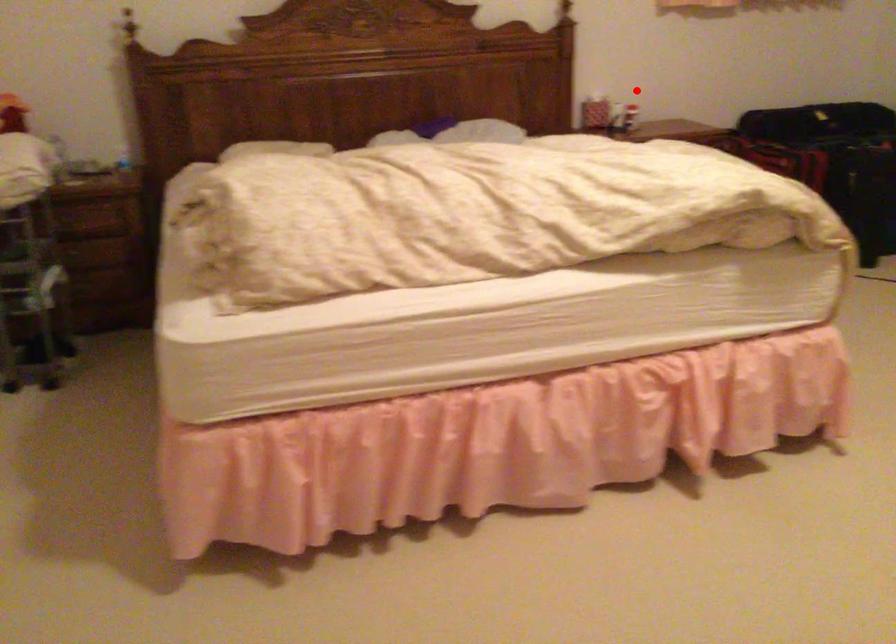
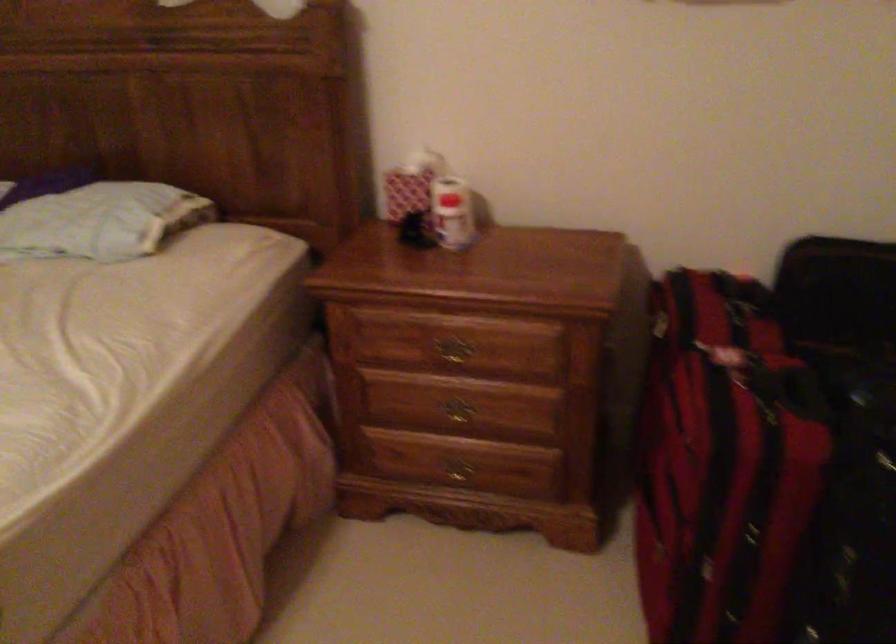
Question: A red point is marked in image1. In image2, is the corresponding 3D point closer to the camera or farther? Reply with the corresponding letter.

Choices:
 (A) The corresponding 3D point is closer.
 (B) The corresponding 3D point is farther.

Answer: (A)